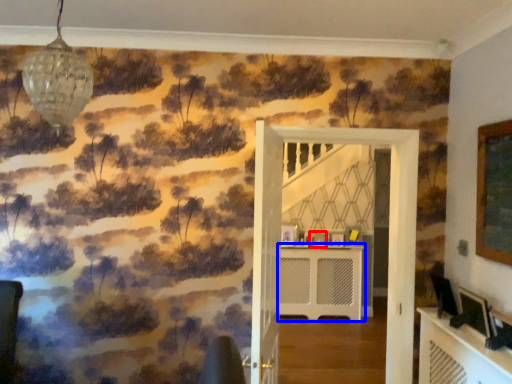
Question: Which of the following is the closest to the observer, picture frame (highlighted by a red box) or table (highlighted by a blue box)?

Choices:
 (A) picture frame
 (B) table

Answer: (B)